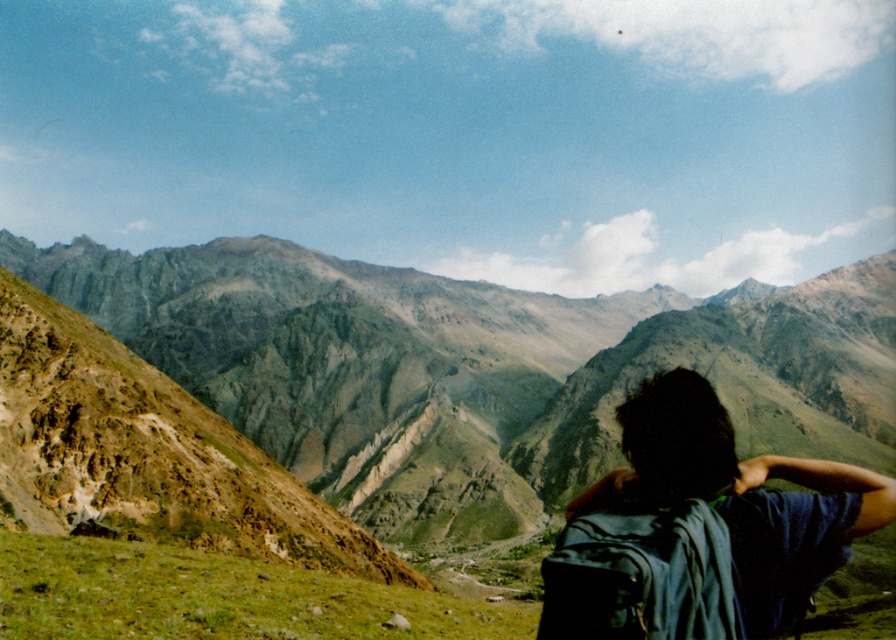
You are a hiker standing at the center of the image. You need to place a GPS marker at the location of the dark blue fabric backpack at lower right. What are the coordinates of the backpack?

The coordinates of the dark blue fabric backpack at lower right are at point (x=739, y=497).